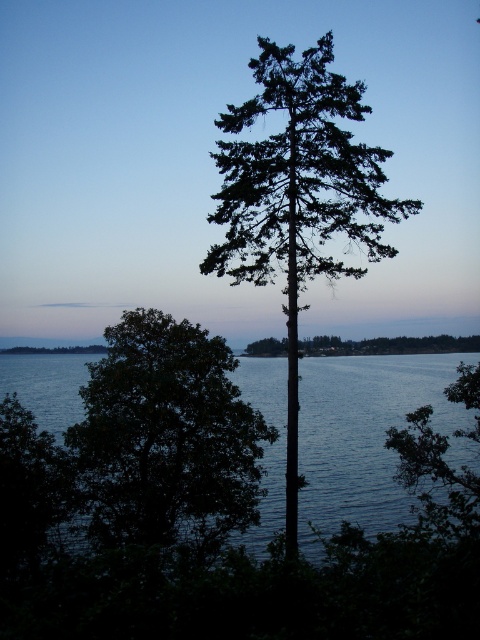
Question: Is green leafy tree at center to the right of green needle-like foliage at center from the viewer's perspective?

Choices:
 (A) no
 (B) yes

Answer: (A)

Question: Which is farther from the green leafy tree at center?

Choices:
 (A) dark blue water at center
 (B) green matte tree at center
 (C) green needle-like foliage at center

Answer: (B)

Question: Is green needle-like foliage at center to the right of dark blue water at center from the viewer's perspective?

Choices:
 (A) no
 (B) yes

Answer: (B)

Question: Which point is closer to the camera?

Choices:
 (A) green leafy tree at center
 (B) green needle-like foliage at center
 (C) dark blue water at center

Answer: (B)

Question: Which point appears farthest from the camera in this image?

Choices:
 (A) (394, 346)
 (B) (316, 156)
 (C) (264, 376)
 (D) (238, 490)

Answer: (A)

Question: Is green leafy tree at center to the left of green matte tree at center from the viewer's perspective?

Choices:
 (A) no
 (B) yes

Answer: (B)